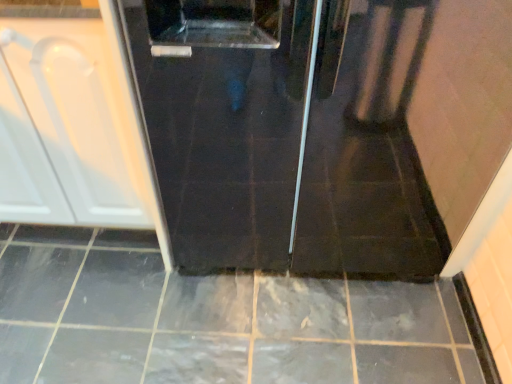
Question: From the image's perspective, does glossy ceramic tile at center appear lower than white glossy cabinet at left?

Choices:
 (A) no
 (B) yes

Answer: (B)

Question: Is glossy ceramic tile at center completely or partially outside of white glossy cabinet at left?

Choices:
 (A) yes
 (B) no

Answer: (A)

Question: From the image's perspective, does glossy ceramic tile at center appear higher than white glossy cabinet at left?

Choices:
 (A) no
 (B) yes

Answer: (A)

Question: Does glossy ceramic tile at center have a greater width compared to white glossy cabinet at left?

Choices:
 (A) yes
 (B) no

Answer: (A)

Question: Can you confirm if glossy ceramic tile at center is thinner than white glossy cabinet at left?

Choices:
 (A) yes
 (B) no

Answer: (B)

Question: Is glossy ceramic tile at center positioned far away from white glossy cabinet at left?

Choices:
 (A) yes
 (B) no

Answer: (B)

Question: From a real-world perspective, is white glossy cabinet at left on top of glossy ceramic tile at center?

Choices:
 (A) no
 (B) yes

Answer: (B)

Question: Does white glossy cabinet at left turn towards glossy ceramic tile at center?

Choices:
 (A) yes
 (B) no

Answer: (B)

Question: From the image's perspective, is white glossy cabinet at left on top of glossy ceramic tile at center?

Choices:
 (A) yes
 (B) no

Answer: (A)

Question: Is the position of white glossy cabinet at left less distant than that of glossy ceramic tile at center?

Choices:
 (A) yes
 (B) no

Answer: (A)

Question: From the image's perspective, does white glossy cabinet at left appear lower than glossy ceramic tile at center?

Choices:
 (A) no
 (B) yes

Answer: (A)

Question: Does white glossy cabinet at left appear on the right side of glossy ceramic tile at center?

Choices:
 (A) yes
 (B) no

Answer: (B)

Question: Considering the positions of white glossy cabinet at left and glossy ceramic tile at center in the image, is white glossy cabinet at left wider or thinner than glossy ceramic tile at center?

Choices:
 (A) wide
 (B) thin

Answer: (B)